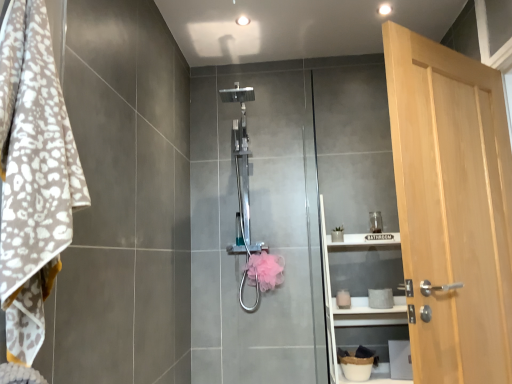
Question: From a real-world perspective, is white matte shelf at center physically below polished chrome shower at center?

Choices:
 (A) yes
 (B) no

Answer: (A)

Question: Is white matte shelf at center turned away from polished chrome shower at center?

Choices:
 (A) yes
 (B) no

Answer: (B)

Question: Can you confirm if white matte shelf at center is taller than polished chrome shower at center?

Choices:
 (A) no
 (B) yes

Answer: (A)

Question: Is white matte shelf at center shorter than polished chrome shower at center?

Choices:
 (A) yes
 (B) no

Answer: (A)

Question: Is white matte shelf at center oriented towards polished chrome shower at center?

Choices:
 (A) no
 (B) yes

Answer: (A)

Question: Does white matte shelf at center have a greater width compared to polished chrome shower at center?

Choices:
 (A) no
 (B) yes

Answer: (A)

Question: Can you confirm if pink fluffy hand towel at center is taller than polished chrome shower at center?

Choices:
 (A) no
 (B) yes

Answer: (A)

Question: From a real-world perspective, is pink fluffy hand towel at center over polished chrome shower at center?

Choices:
 (A) no
 (B) yes

Answer: (A)

Question: From a real-world perspective, does pink fluffy hand towel at center sit lower than polished chrome shower at center?

Choices:
 (A) yes
 (B) no

Answer: (A)

Question: Can you confirm if pink fluffy hand towel at center is bigger than polished chrome shower at center?

Choices:
 (A) no
 (B) yes

Answer: (A)

Question: Is pink fluffy hand towel at center oriented towards polished chrome shower at center?

Choices:
 (A) yes
 (B) no

Answer: (A)

Question: Considering the relative positions of pink fluffy hand towel at center and polished chrome shower at center in the image provided, is pink fluffy hand towel at center in front of polished chrome shower at center?

Choices:
 (A) yes
 (B) no

Answer: (B)

Question: Does polished chrome shower at center come behind pink fluffy hand towel at center?

Choices:
 (A) yes
 (B) no

Answer: (B)